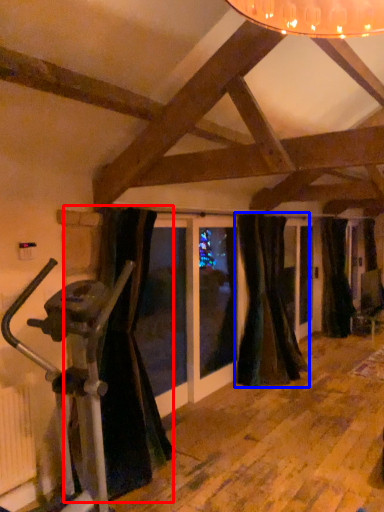
Question: Which object appears closest to the camera in this image, curtain (highlighted by a red box) or curtain (highlighted by a blue box)?

Choices:
 (A) curtain
 (B) curtain

Answer: (A)